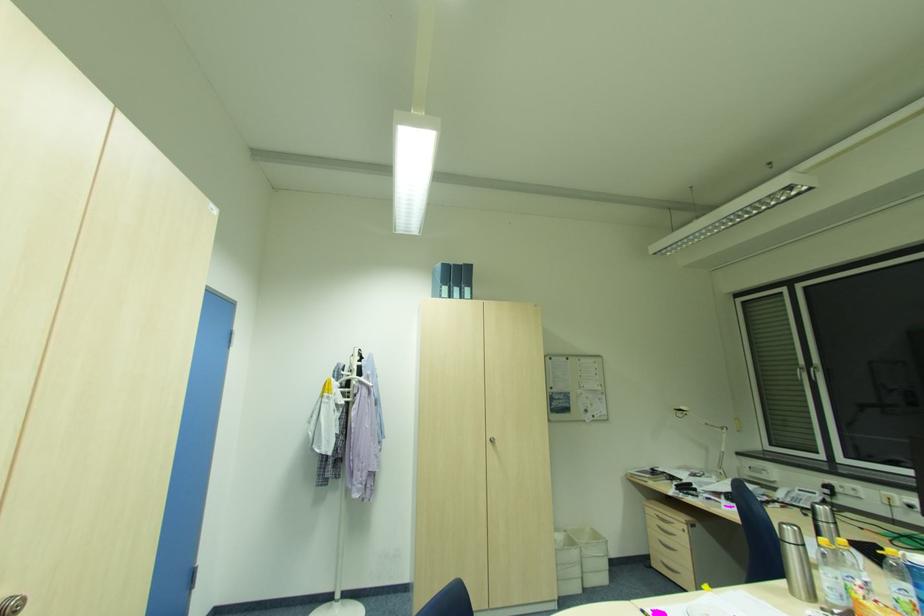
This screenshot has width=924, height=616. I want to click on plastic water bottle, so click(900, 584).